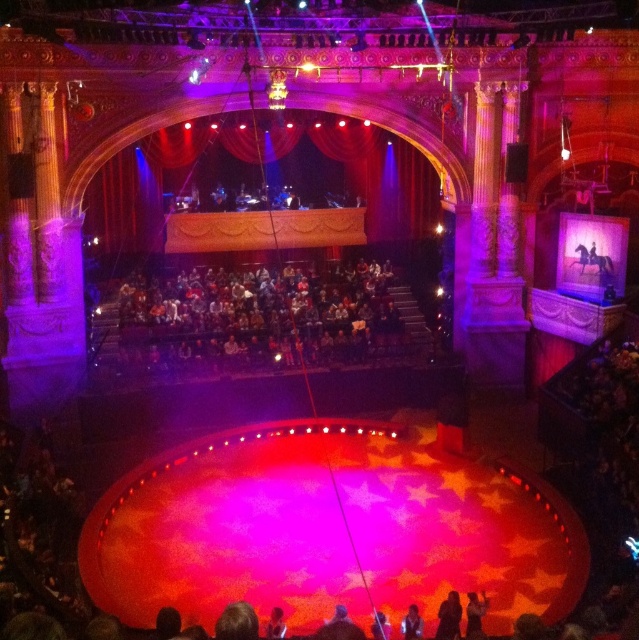
Question: Which of the following is the farthest from the observer?

Choices:
 (A) dark brown leather jacket at lower center
 (B) red velvet curtain at upper center
 (C) dark gray fabric crowd at center
 (D) smooth skin face at center

Answer: (B)

Question: Is silhouette fabric person at lower center closer to camera compared to smooth skin face at center?

Choices:
 (A) yes
 (B) no

Answer: (A)

Question: Which object is closer to the camera taking this photo?

Choices:
 (A) smooth skin face at center
 (B) dark brown leather jacket at lower center
 (C) red velvet curtain at upper center
 (D) dark gray fabric crowd at center

Answer: (B)

Question: Can you confirm if dark gray fabric crowd at center is positioned to the left of smooth skin face at center?

Choices:
 (A) no
 (B) yes

Answer: (B)

Question: Which point is farther from the camera taking this photo?

Choices:
 (A) (367, 131)
 (B) (470, 625)

Answer: (A)

Question: Does dark gray fabric crowd at center come behind dark brown leather jacket at lower center?

Choices:
 (A) no
 (B) yes

Answer: (B)